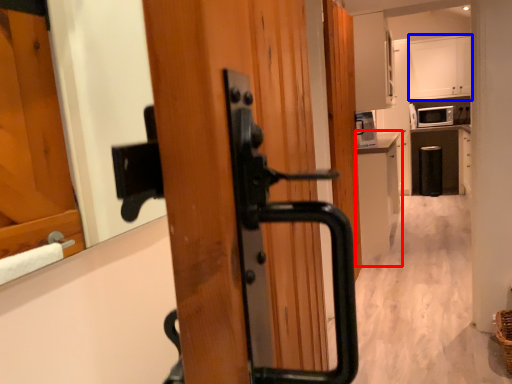
Question: Which of the following is the closest to the observer, cabinetry (highlighted by a red box) or cabinetry (highlighted by a blue box)?

Choices:
 (A) cabinetry
 (B) cabinetry

Answer: (A)